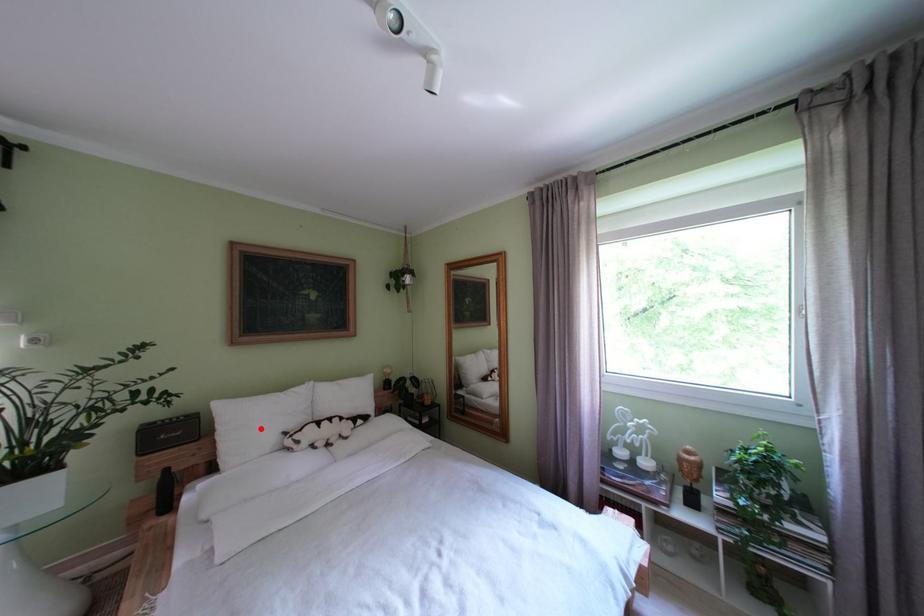
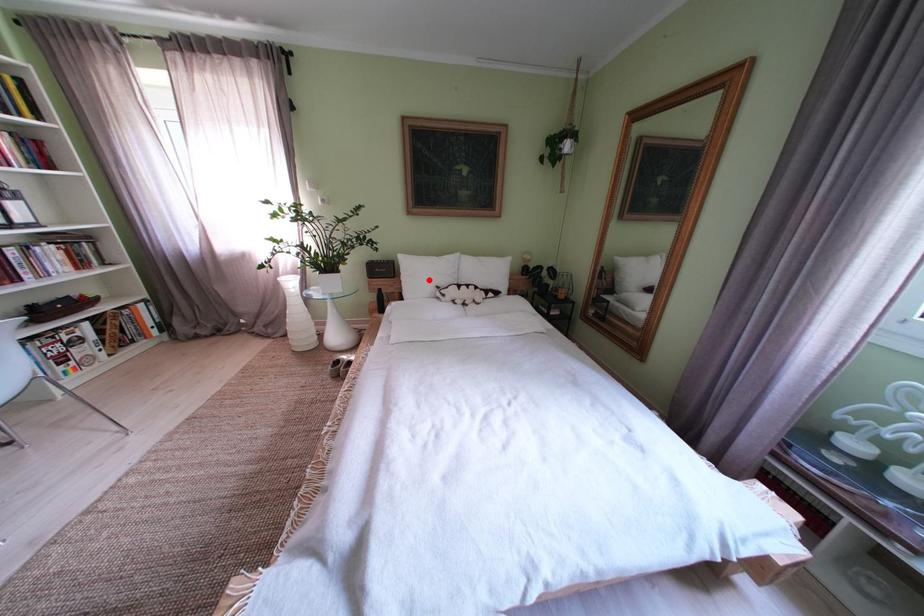
I am providing you with two images of the same scene from different viewpoints. A red point is marked on the first image and another point is marked on the second image. Do the highlighted points in image1 and image2 indicate the same real-world spot?

Yes